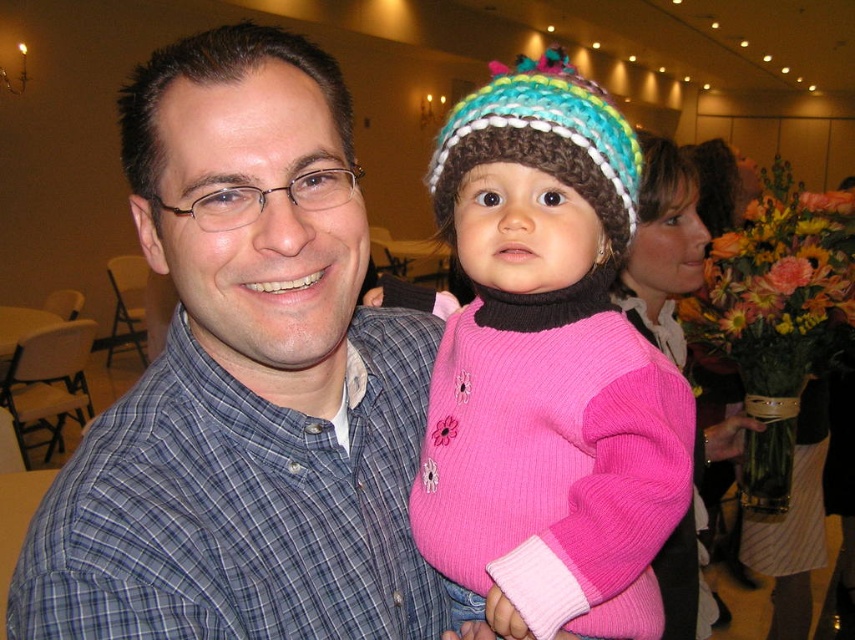
Question: Which point is closer to the camera taking this photo?

Choices:
 (A) (423, 538)
 (B) (565, 131)

Answer: (B)

Question: Can you confirm if knitted pink sweater at center is positioned to the right of crochet knit hat at center?

Choices:
 (A) no
 (B) yes

Answer: (A)

Question: Which of the following is the farthest from the observer?

Choices:
 (A) (251, 177)
 (B) (482, 116)
 (C) (582, 120)

Answer: (B)

Question: Is blue plaid shirt at center above crochet knit hat at center?

Choices:
 (A) yes
 (B) no

Answer: (B)

Question: Is knitted pink sweater at center wider than crochet knit hat at center?

Choices:
 (A) no
 (B) yes

Answer: (B)

Question: Which point is farther from the camera taking this photo?

Choices:
 (A) (464, 364)
 (B) (593, 182)

Answer: (A)